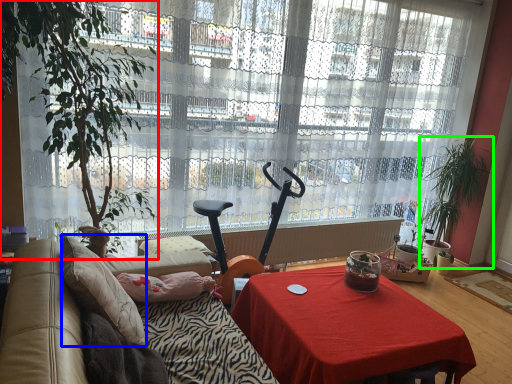
Question: Considering the real-world distances, which object is farthest from houseplant (highlighted by a red box)? pillow (highlighted by a blue box) or houseplant (highlighted by a green box)?

Choices:
 (A) pillow
 (B) houseplant

Answer: (B)